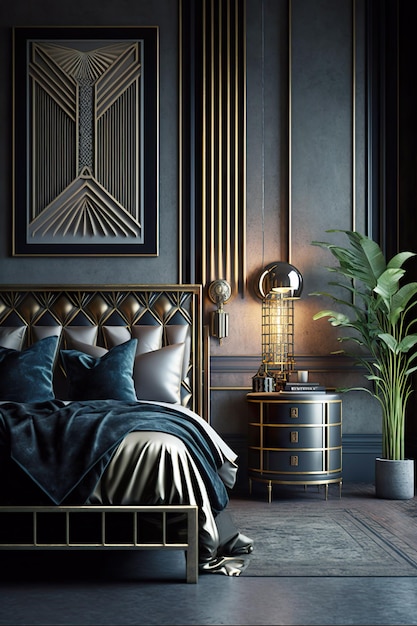
Identify the location of nightstand. This screenshot has height=626, width=417. (298, 437).